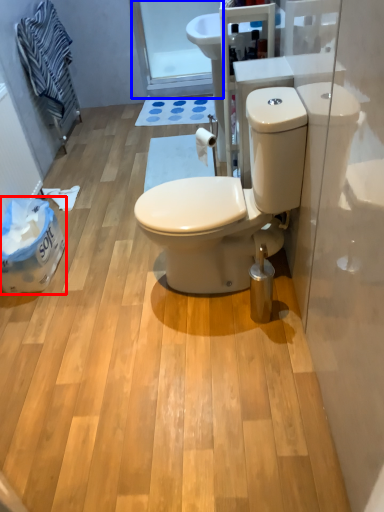
Question: Which of the following is the farthest to the observer, garbage (highlighted by a red box) or glass door (highlighted by a blue box)?

Choices:
 (A) garbage
 (B) glass door

Answer: (B)